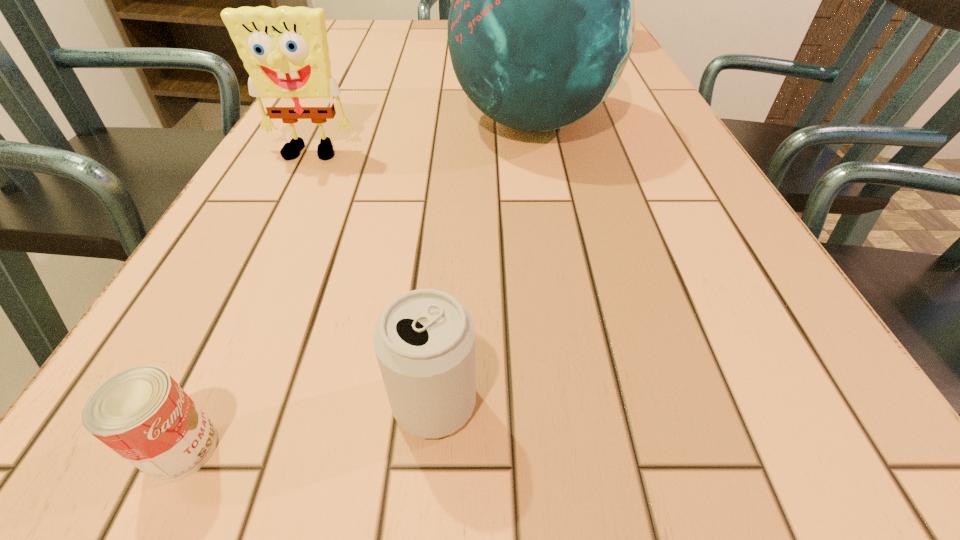
Identify the location of globe. (541, 25).

You are a GUI agent. You are given a task and a screenshot of the screen. Output one action in this format:
    pyautogui.click(x=<x>, y=<y>)
    Task: Click on the third shortest object
    
    Given the screenshot: What is the action you would take?
    pyautogui.click(x=285, y=51)

Where is `the right can`? the right can is located at coordinates (424, 342).

The width and height of the screenshot is (960, 540). What are the coordinates of `the second shortest object` in the screenshot? It's located at (424, 342).

Locate an element on the screen. the shorter can is located at coordinates (141, 413).

The height and width of the screenshot is (540, 960). I want to click on the left can, so click(x=141, y=413).

Locate an element on the screen. The height and width of the screenshot is (540, 960). vacant area located on the back of the globe is located at coordinates (520, 56).

Where is `vacant space situated 0.160m on the face of the sponge`? The width and height of the screenshot is (960, 540). vacant space situated 0.160m on the face of the sponge is located at coordinates (274, 225).

This screenshot has width=960, height=540. In order to click on vacant region located on the back of the taller can in this screenshot , I will do `click(444, 283)`.

The width and height of the screenshot is (960, 540). In order to click on blank area located 0.100m on the front label of the left can in this screenshot , I will do `click(318, 449)`.